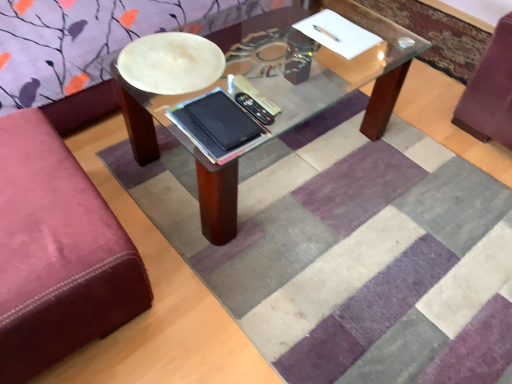
Image resolution: width=512 pixels, height=384 pixels. Find the location of `empty space that is to the right of velvet maroon ottoman at left`. empty space that is to the right of velvet maroon ottoman at left is located at coordinates pos(215,283).